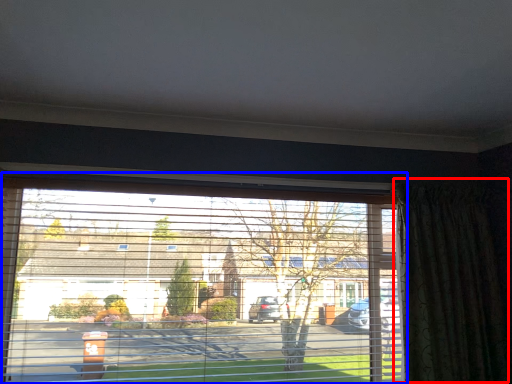
Question: Which object is closer to the camera taking this photo, curtain (highlighted by a red box) or window (highlighted by a blue box)?

Choices:
 (A) curtain
 (B) window

Answer: (B)